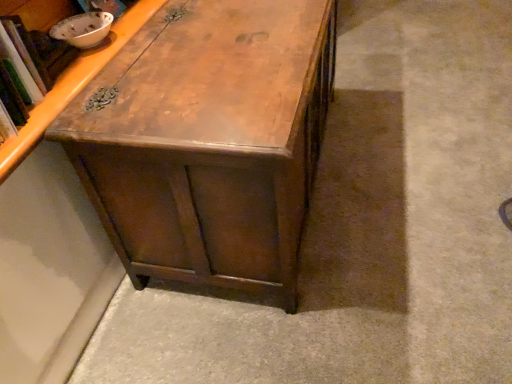
Question: Should I look upward or downward to see wooden chest at center?

Choices:
 (A) up
 (B) down

Answer: (A)

Question: Is wooden chest at center not near wooden cabinet at upper left?

Choices:
 (A) yes
 (B) no

Answer: (B)

Question: Is wooden chest at center thinner than wooden cabinet at upper left?

Choices:
 (A) yes
 (B) no

Answer: (B)

Question: Is wooden chest at center facing towards wooden cabinet at upper left?

Choices:
 (A) no
 (B) yes

Answer: (A)

Question: Considering the relative sizes of wooden chest at center and wooden cabinet at upper left in the image provided, is wooden chest at center smaller than wooden cabinet at upper left?

Choices:
 (A) no
 (B) yes

Answer: (A)

Question: Can you confirm if wooden chest at center is positioned to the left of wooden cabinet at upper left?

Choices:
 (A) yes
 (B) no

Answer: (B)

Question: From a real-world perspective, does wooden chest at center sit lower than wooden cabinet at upper left?

Choices:
 (A) no
 (B) yes

Answer: (B)

Question: Can wooden chest at center be found inside wooden cabinet at upper left?

Choices:
 (A) yes
 (B) no

Answer: (B)

Question: From the image's perspective, is wooden cabinet at upper left on top of wooden chest at center?

Choices:
 (A) no
 (B) yes

Answer: (A)

Question: Is wooden cabinet at upper left positioned far away from wooden chest at center?

Choices:
 (A) no
 (B) yes

Answer: (A)

Question: Does wooden cabinet at upper left have a greater height compared to wooden chest at center?

Choices:
 (A) yes
 (B) no

Answer: (B)

Question: Is wooden cabinet at upper left positioned in front of wooden chest at center?

Choices:
 (A) yes
 (B) no

Answer: (A)

Question: Does wooden cabinet at upper left appear on the right side of wooden chest at center?

Choices:
 (A) no
 (B) yes

Answer: (A)

Question: Considering the positions of wooden chest at center and wooden cabinet at upper left in the image, is wooden chest at center bigger or smaller than wooden cabinet at upper left?

Choices:
 (A) big
 (B) small

Answer: (A)